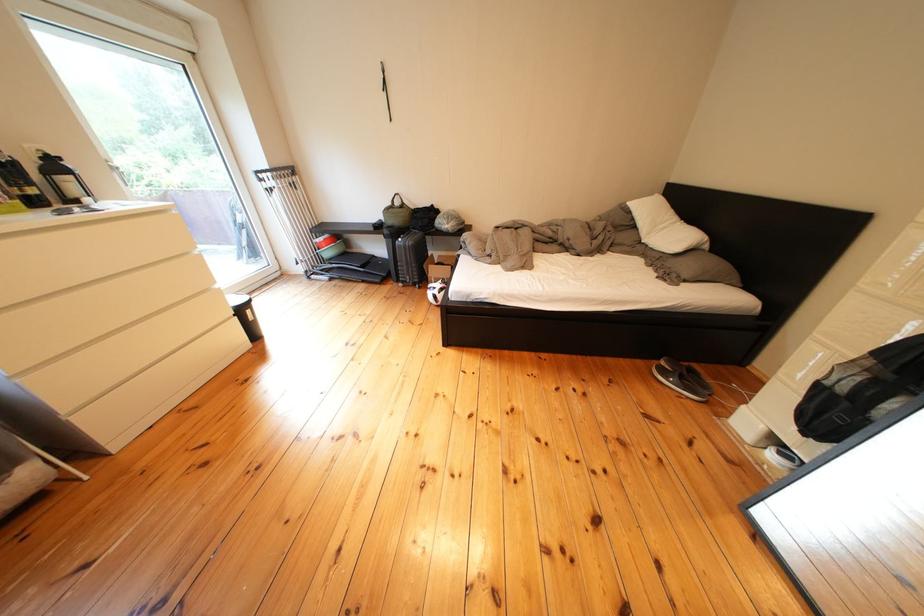
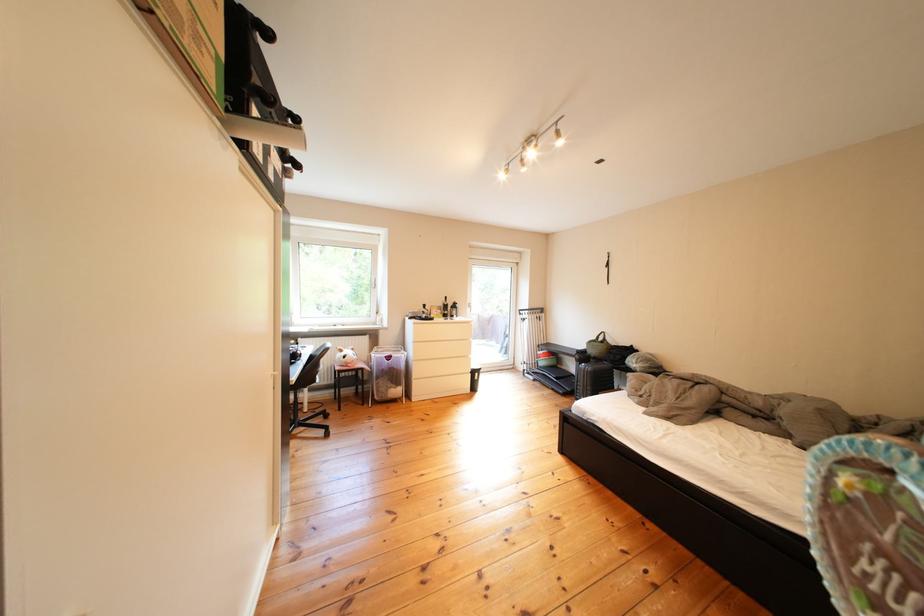
Question: I am providing you with two images of the same scene from different viewpoints. After the viewpoint changes to image2, which objects are now occluded?

Choices:
 (A) stuffed animal toy
 (B) green handbag
 (C) blue fabric bag
 (D) white soccer ball

Answer: (D)